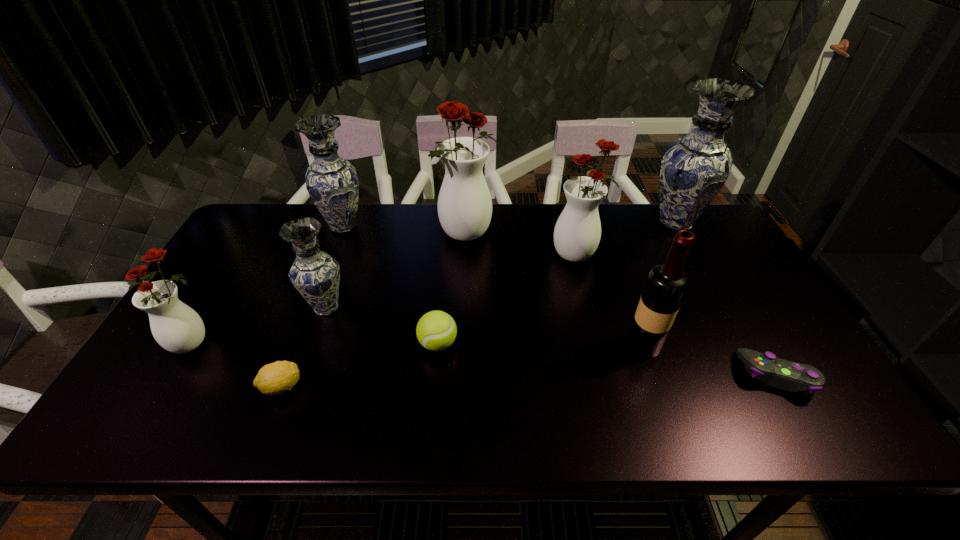
Image resolution: width=960 pixels, height=540 pixels. In order to click on free space between the second biggest blue vase and the biggest blue vase in this screenshot , I will do `click(510, 225)`.

Find the location of a particular element. vacant space that's between the third shortest object and the rightmost blue vase is located at coordinates (557, 284).

Where is `free space between the second biggest red vase and the second red vase from left to right`? Image resolution: width=960 pixels, height=540 pixels. free space between the second biggest red vase and the second red vase from left to right is located at coordinates (522, 245).

I want to click on free space between the fourth vase from left to right and the wine bottle, so click(x=555, y=290).

You are a GUI agent. You are given a task and a screenshot of the screen. Output one action in this format:
    pyautogui.click(x=<x>, y=<y>)
    Task: Click on the vacant area between the second smallest blue vase and the leftmost vase
    
    Given the screenshot: What is the action you would take?
    pyautogui.click(x=268, y=285)

This screenshot has height=540, width=960. Identify the location of vacant area that lies between the green tennis ball and the gray control. (608, 359).

At what (x,y) coordinates should I click in order to perform the action: click on empty location between the second smallest blue vase and the second red vase from right to left. Please return your answer as a coordinate pair (x, y). Image resolution: width=960 pixels, height=540 pixels. Looking at the image, I should click on (405, 231).

Locate an element on the screen. Image resolution: width=960 pixels, height=540 pixels. object that can be found as the fifth closest to the second biggest red vase is located at coordinates [x=790, y=376].

The width and height of the screenshot is (960, 540). I want to click on object that is the third closest to the second smallest blue vase, so click(x=176, y=327).

This screenshot has width=960, height=540. Identify the location of the closest vase relative to the rightmost red vase. (695, 167).